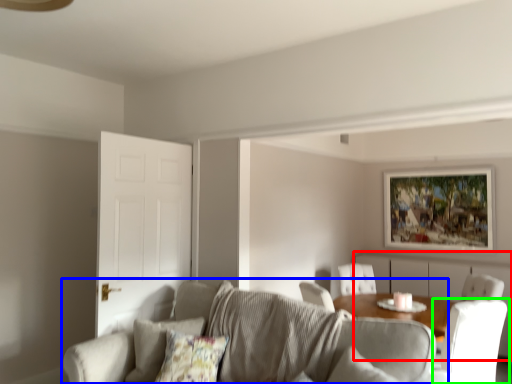
Question: Based on their relative distances, which object is nearer to dresser (highlighted by a red box)? Choose from studio couch (highlighted by a blue box) and chair (highlighted by a green box).

Choices:
 (A) studio couch
 (B) chair

Answer: (B)